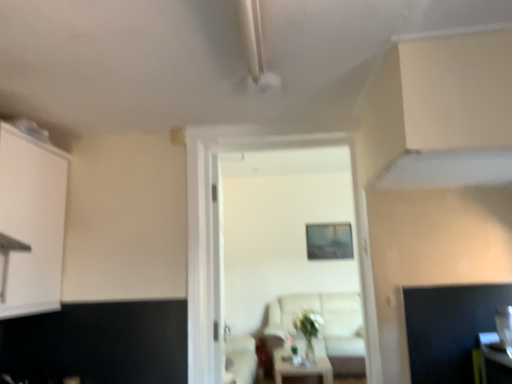
Question: Is white wooden door at center bigger or smaller than transparent glass door at center?

Choices:
 (A) big
 (B) small

Answer: (A)

Question: From the image's perspective, is white wooden door at center positioned above or below transparent glass door at center?

Choices:
 (A) below
 (B) above

Answer: (B)

Question: Estimate the real-world distances between objects in this image. Which object is farther from the white glossy table at center?

Choices:
 (A) white matte cabinet at left
 (B) transparent glass door at center
 (C) beige fabric couch at center
 (D) white wooden door at center

Answer: (A)

Question: Estimate the real-world distances between objects in this image. Which object is farther from the beige fabric couch at center?

Choices:
 (A) white glossy table at center
 (B) white matte cabinet at left
 (C) white wooden door at center
 (D) transparent glass door at center

Answer: (B)